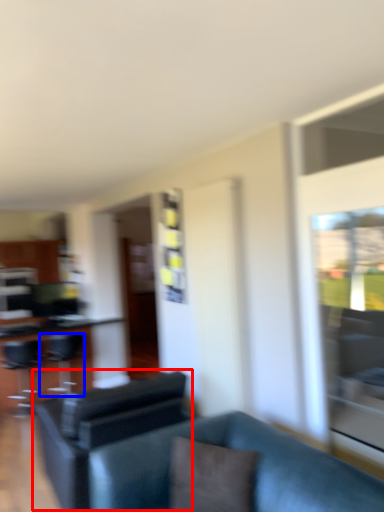
Question: Which point is closer to the camera, swivel chair (highlighted by a red box) or swivel chair (highlighted by a blue box)?

Choices:
 (A) swivel chair
 (B) swivel chair

Answer: (A)